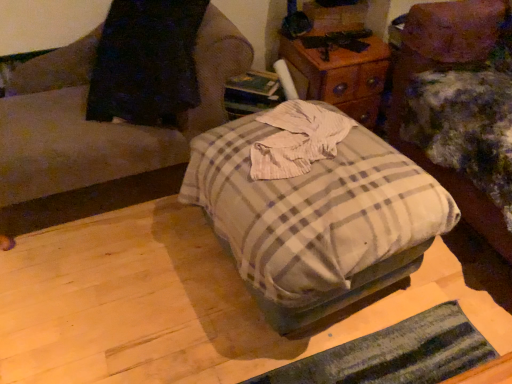
Question: Considering the relative positions of wooden nightstand at upper center and plaid fabric ottoman at center in the image provided, is wooden nightstand at upper center in front of plaid fabric ottoman at center?

Choices:
 (A) yes
 (B) no

Answer: (B)

Question: Does wooden nightstand at upper center have a larger size compared to plaid fabric ottoman at center?

Choices:
 (A) yes
 (B) no

Answer: (B)

Question: Can you confirm if wooden nightstand at upper center is positioned to the left of plaid fabric ottoman at center?

Choices:
 (A) no
 (B) yes

Answer: (A)

Question: Is wooden nightstand at upper center positioned far away from plaid fabric ottoman at center?

Choices:
 (A) no
 (B) yes

Answer: (A)

Question: From the image's perspective, is wooden nightstand at upper center under plaid fabric ottoman at center?

Choices:
 (A) yes
 (B) no

Answer: (B)

Question: Can you confirm if wooden nightstand at upper center is thinner than plaid fabric ottoman at center?

Choices:
 (A) yes
 (B) no

Answer: (A)

Question: Is the depth of plaid fabric ottoman at center, which is the 1th furniture in left-to-right order, less than that of wooden nightstand at upper center?

Choices:
 (A) yes
 (B) no

Answer: (A)

Question: Can you confirm if plaid fabric ottoman at center, the second furniture when ordered from right to left, is smaller than wooden nightstand at upper center?

Choices:
 (A) no
 (B) yes

Answer: (A)

Question: Considering the relative sizes of plaid fabric ottoman at center, the second furniture when ordered from right to left, and wooden nightstand at upper center in the image provided, is plaid fabric ottoman at center, the second furniture when ordered from right to left, bigger than wooden nightstand at upper center?

Choices:
 (A) no
 (B) yes

Answer: (B)

Question: From the image's perspective, does plaid fabric ottoman at center, the second furniture when ordered from right to left, appear higher than wooden nightstand at upper center?

Choices:
 (A) yes
 (B) no

Answer: (B)

Question: Does plaid fabric ottoman at center, which is the 1th furniture in left-to-right order, have a lesser width compared to wooden nightstand at upper center?

Choices:
 (A) no
 (B) yes

Answer: (A)

Question: Does plaid fabric ottoman at center, the second furniture when ordered from right to left, appear on the right side of wooden nightstand at upper center?

Choices:
 (A) no
 (B) yes

Answer: (A)

Question: Is plaid fabric ottoman at center facing away from wooden nightstand at upper center?

Choices:
 (A) yes
 (B) no

Answer: (B)